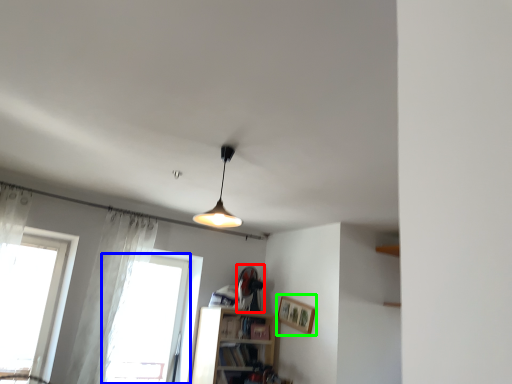
Question: Estimate the real-world distances between objects in this image. Which object is farther from fan (highlighted by a red box), window (highlighted by a blue box) or picture frame (highlighted by a green box)?

Choices:
 (A) window
 (B) picture frame

Answer: (A)